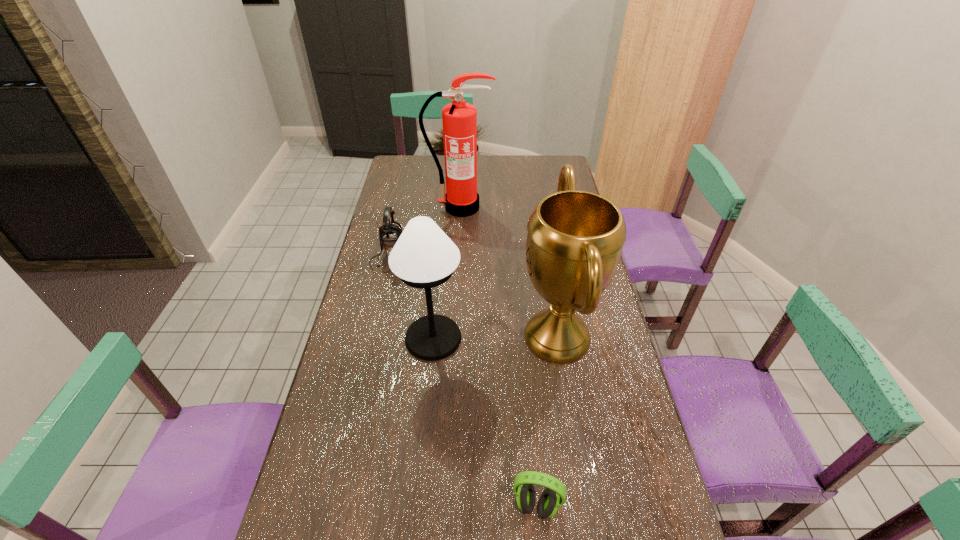
Where is `the farthest object`? This screenshot has width=960, height=540. the farthest object is located at coordinates (459, 119).

The width and height of the screenshot is (960, 540). Identify the location of trophy cup. (575, 239).

Find the location of a particular element. This screenshot has height=540, width=960. table lamp is located at coordinates (424, 257).

At what (x,y) coordinates should I click in order to perform the action: click on the second shortest object. Please return your answer as a coordinate pair (x, y). The image size is (960, 540). Looking at the image, I should click on pos(389,233).

In order to click on earphone in this screenshot , I will do `click(389, 233)`.

The height and width of the screenshot is (540, 960). In order to click on the nearest object in this screenshot , I will do 549,502.

The width and height of the screenshot is (960, 540). In order to click on headset in this screenshot , I will do `click(549, 502)`.

At what (x,y) coordinates should I click in order to perform the action: click on free region located 0.110m with the nozzle aimed from the fire extinguisher. Please return your answer as a coordinate pair (x, y). The image size is (960, 540). Looking at the image, I should click on (458, 234).

Identify the location of vacant space located 0.310m on the surface of the trophy cup with symbols. (416, 337).

I want to click on vacant area located 0.350m on the surface of the trophy cup with symbols, so click(x=402, y=337).